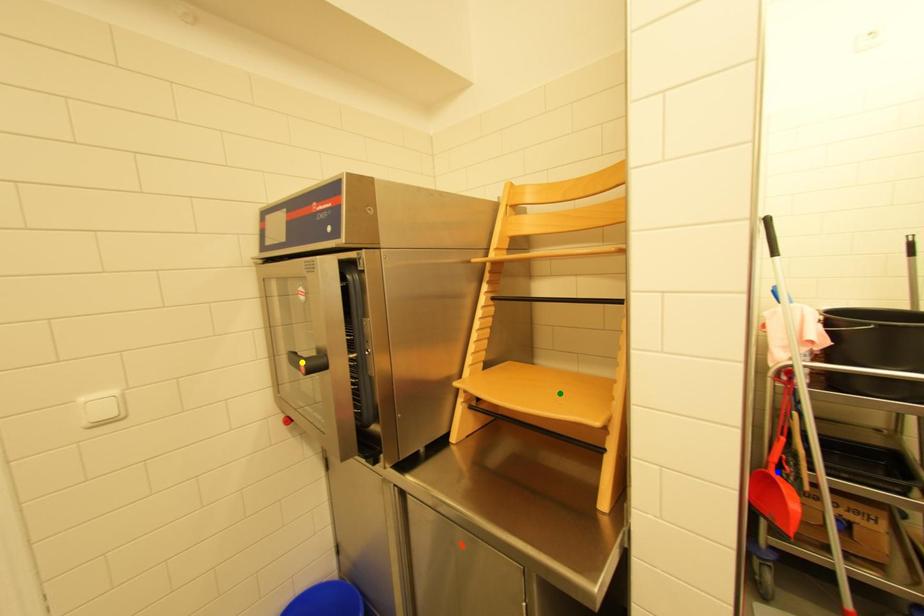
Order these from farthest to nearest:
blue point | yellow point | green point

green point → blue point → yellow point